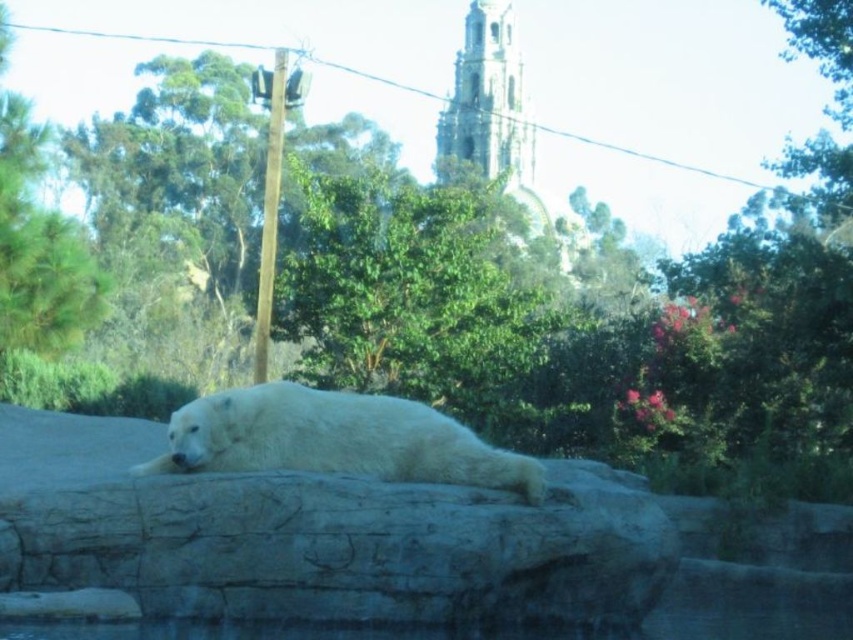
You are a zookeeper observing the polar bear enclosure. You see the white fur bear at center and the white smooth rock at center. Which object takes up more space in the enclosure?

The white smooth rock at center is bigger than the white fur bear at center, so it takes up more space in the enclosure.